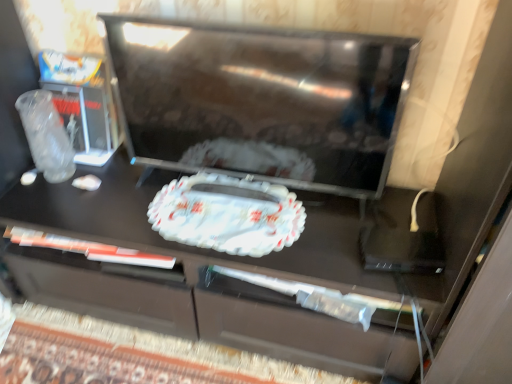
Question: Is black glossy tv at center completely or partially outside of white glossy tray at center?

Choices:
 (A) yes
 (B) no

Answer: (A)

Question: Is black glossy tv at center taller than white glossy tray at center?

Choices:
 (A) yes
 (B) no

Answer: (A)

Question: Considering the relative positions of black glossy tv at center and white glossy tray at center in the image provided, is black glossy tv at center in front of white glossy tray at center?

Choices:
 (A) no
 (B) yes

Answer: (B)

Question: Is black glossy tv at center not close to white glossy tray at center?

Choices:
 (A) no
 (B) yes

Answer: (A)

Question: Is black glossy tv at center positioned with its back to white glossy tray at center?

Choices:
 (A) yes
 (B) no

Answer: (B)

Question: Can you confirm if black glossy tv at center is positioned to the left of white glossy tray at center?

Choices:
 (A) no
 (B) yes

Answer: (A)

Question: Is white glossy tray at center beside black glossy tv at center?

Choices:
 (A) yes
 (B) no

Answer: (B)

Question: Is black glossy tv at center located within white glossy tray at center?

Choices:
 (A) no
 (B) yes

Answer: (A)

Question: Considering the relative sizes of white glossy tray at center and black glossy tv at center in the image provided, is white glossy tray at center wider than black glossy tv at center?

Choices:
 (A) no
 (B) yes

Answer: (B)

Question: Considering the relative sizes of white glossy tray at center and black glossy tv at center in the image provided, is white glossy tray at center taller than black glossy tv at center?

Choices:
 (A) yes
 (B) no

Answer: (B)

Question: Is white glossy tray at center shorter than black glossy tv at center?

Choices:
 (A) yes
 (B) no

Answer: (A)

Question: Can you confirm if white glossy tray at center is positioned to the right of black glossy tv at center?

Choices:
 (A) no
 (B) yes

Answer: (A)

Question: From the image's perspective, is black glossy tv at center above or below white glossy tray at center?

Choices:
 (A) below
 (B) above

Answer: (B)